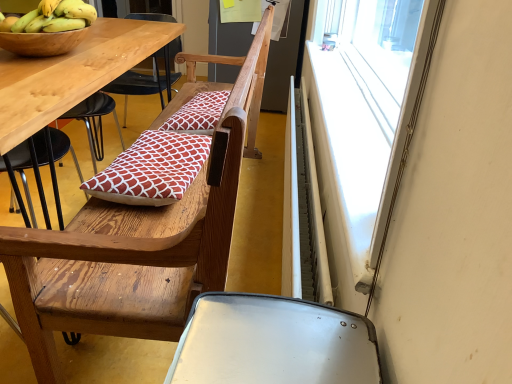
Question: Is red printed cushion at center, the 2th pillow when ordered from top to bottom, located within yellow matte bananas at upper left?

Choices:
 (A) yes
 (B) no

Answer: (B)

Question: From a real-world perspective, is yellow matte bananas at upper left located higher than red printed cushion at center, the 2th pillow when ordered from top to bottom?

Choices:
 (A) no
 (B) yes

Answer: (B)

Question: From a real-world perspective, is yellow matte bananas at upper left beneath red printed cushion at center, the 2th pillow when ordered from top to bottom?

Choices:
 (A) no
 (B) yes

Answer: (A)

Question: Can you confirm if yellow matte bananas at upper left is taller than red printed cushion at center, which appears as the 2th pillow when viewed from the back?

Choices:
 (A) yes
 (B) no

Answer: (A)

Question: Is yellow matte bananas at upper left looking in the opposite direction of red printed cushion at center, the 2th pillow when ordered from top to bottom?

Choices:
 (A) yes
 (B) no

Answer: (B)

Question: Is the position of yellow matte bananas at upper left less distant than that of red printed cushion at center, the 2th pillow when ordered from top to bottom?

Choices:
 (A) no
 (B) yes

Answer: (B)

Question: Is white metallic radiator at right taller than wooden chair at center?

Choices:
 (A) yes
 (B) no

Answer: (B)

Question: Does white metallic radiator at right have a greater width compared to wooden chair at center?

Choices:
 (A) no
 (B) yes

Answer: (A)

Question: Are white metallic radiator at right and wooden chair at center far apart?

Choices:
 (A) no
 (B) yes

Answer: (A)

Question: From a real-world perspective, is white metallic radiator at right physically below wooden chair at center?

Choices:
 (A) yes
 (B) no

Answer: (A)

Question: Is white metallic radiator at right thinner than wooden chair at center?

Choices:
 (A) no
 (B) yes

Answer: (B)

Question: Is white metallic radiator at right behind wooden chair at center?

Choices:
 (A) no
 (B) yes

Answer: (B)

Question: Is wooden chair at center far away from red printed cushion at center, the 1th pillow in the front-to-back sequence?

Choices:
 (A) no
 (B) yes

Answer: (A)